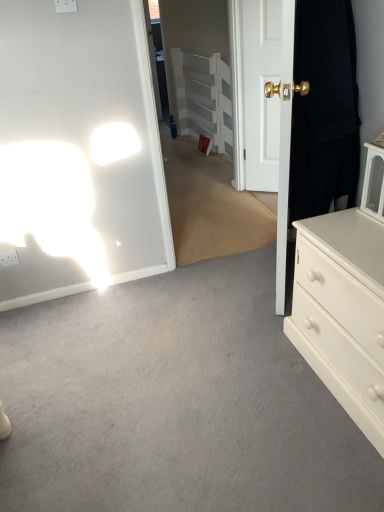
Locate an element on the screen. Image resolution: width=384 pixels, height=512 pixels. clear glass door at center is located at coordinates click(x=209, y=206).

Image resolution: width=384 pixels, height=512 pixels. Describe the element at coordinates (209, 206) in the screenshot. I see `clear glass door at center` at that location.

Image resolution: width=384 pixels, height=512 pixels. I want to click on white matte chest of drawers at right, so click(x=343, y=312).

What are the coordinates of `black fabric door at right, positioned as the 2th door in back-to-front order` in the screenshot? It's located at 323,109.

Consider the image. Which object is closer to the camera taking this photo, clear glass door at center or black fabric door at right, acting as the first door starting from the front?

black fabric door at right, acting as the first door starting from the front.

Is point (246, 230) in front of point (329, 134)?

That is False.

Is clear glass door at center to the left of black fabric door at right, positioned as the 2th door in back-to-front order, from the viewer's perspective?

Indeed, clear glass door at center is positioned on the left side of black fabric door at right, positioned as the 2th door in back-to-front order.

From a real-world perspective, between clear glass door at center and black fabric door at right, positioned as the 2th door in back-to-front order, who is vertically higher?

black fabric door at right, positioned as the 2th door in back-to-front order, is physically above.

This screenshot has height=512, width=384. Find the location of `door on the right side of white glossy door at center, arranged as the first door when viewed from the back`. door on the right side of white glossy door at center, arranged as the first door when viewed from the back is located at coordinates (323, 109).

From a real-world perspective, is white glossy door at center, arranged as the first door when viewed from the back, positioned under black fabric door at right, acting as the first door starting from the front, based on gravity?

Yes.

Is point (274, 32) less distant than point (310, 150)?

No, it is not.

Is white glossy door at center, arranged as the first door when viewed from the back, oriented away from black fabric door at right, acting as the first door starting from the front?

No, white glossy door at center, arranged as the first door when viewed from the back, is not facing the opposite direction of black fabric door at right, acting as the first door starting from the front.

What's the angular difference between white glossy door at center, arranged as the first door when viewed from the back, and clear glass door at center's facing directions?

The angular difference between white glossy door at center, arranged as the first door when viewed from the back, and clear glass door at center is 39.7 degrees.

Considering the sizes of white glossy door at center, arranged as the first door when viewed from the back, and clear glass door at center in the image, is white glossy door at center, arranged as the first door when viewed from the back, taller or shorter than clear glass door at center?

Clearly, white glossy door at center, arranged as the first door when viewed from the back, is shorter compared to clear glass door at center.

From the image's perspective, which one is positioned higher, white glossy door at center, arranged as the 2th door when viewed from the front, or clear glass door at center?

white glossy door at center, arranged as the 2th door when viewed from the front, appears higher in the image.

Which is behind, point (244, 164) or point (224, 93)?

The point (224, 93) is behind.

In the scene shown: Is white glossy door at center, arranged as the 2th door when viewed from the front, to the left or to the right of white painted wood armoire at center in the image?

From the image, it's evident that white glossy door at center, arranged as the 2th door when viewed from the front, is to the right of white painted wood armoire at center.

Can you tell me how much white glossy door at center, arranged as the first door when viewed from the back, and white painted wood armoire at center differ in facing direction?

The angular difference between white glossy door at center, arranged as the first door when viewed from the back, and white painted wood armoire at center is 45.4 degrees.

How far apart are white glossy door at center, arranged as the 2th door when viewed from the front, and white painted wood armoire at center?

white glossy door at center, arranged as the 2th door when viewed from the front, is 4.29 feet from white painted wood armoire at center.

From a real-world perspective, who is located higher, black fabric door at right, positioned as the 2th door in back-to-front order, or white glossy door at center, arranged as the 2th door when viewed from the front?

From a 3D spatial view, black fabric door at right, positioned as the 2th door in back-to-front order, is above.

Is point (331, 141) positioned after point (259, 19)?

No, (331, 141) is closer to viewer.

From the picture: Is black fabric door at right, acting as the first door starting from the front, directly adjacent to white glossy door at center, arranged as the 2th door when viewed from the front?

black fabric door at right, acting as the first door starting from the front, and white glossy door at center, arranged as the 2th door when viewed from the front, are clearly separated.

Can you confirm if black fabric door at right, positioned as the 2th door in back-to-front order, is taller than white glossy door at center, arranged as the 2th door when viewed from the front?

No, black fabric door at right, positioned as the 2th door in back-to-front order, is not taller than white glossy door at center, arranged as the 2th door when viewed from the front.

Between clear glass door at center and white glossy door at center, arranged as the 2th door when viewed from the front, which one is positioned in front?

clear glass door at center is closer to the camera.

Are clear glass door at center and white glossy door at center, arranged as the 2th door when viewed from the front, located far from each other?

No, clear glass door at center is not far away from white glossy door at center, arranged as the 2th door when viewed from the front.

Between clear glass door at center and white glossy door at center, arranged as the first door when viewed from the back, which one has smaller width?

white glossy door at center, arranged as the first door when viewed from the back, is thinner.

Considering the relative sizes of clear glass door at center and white glossy door at center, arranged as the 2th door when viewed from the front, in the image provided, is clear glass door at center bigger than white glossy door at center, arranged as the 2th door when viewed from the front,?

Correct, clear glass door at center is larger in size than white glossy door at center, arranged as the 2th door when viewed from the front.

From the image's perspective, which object appears higher, white painted wood armoire at center or white glossy door at center, arranged as the first door when viewed from the back?

From the image's view, white painted wood armoire at center is above.

Is white painted wood armoire at center looking in the opposite direction of white glossy door at center, arranged as the 2th door when viewed from the front?

white painted wood armoire at center is not turned away from white glossy door at center, arranged as the 2th door when viewed from the front.

In the scene shown: How different are the orientations of white painted wood armoire at center and white glossy door at center, arranged as the first door when viewed from the back, in degrees?

The angular difference between white painted wood armoire at center and white glossy door at center, arranged as the first door when viewed from the back, is 45.4 degrees.

Which of these two, white painted wood armoire at center or white glossy door at center, arranged as the first door when viewed from the back, is smaller?

white glossy door at center, arranged as the first door when viewed from the back, is smaller.

This screenshot has width=384, height=512. I want to click on glass door located behind the black fabric door at right, acting as the first door starting from the front, so click(x=209, y=206).

The image size is (384, 512). Identify the location of door located on the right of white glossy door at center, arranged as the 2th door when viewed from the front. (323, 109).

From the picture: When comparing their distances from white painted wood armoire at center, does white glossy door at center, arranged as the first door when viewed from the back, or black fabric door at right, positioned as the 2th door in back-to-front order, seem further?

Based on the image, black fabric door at right, positioned as the 2th door in back-to-front order, appears to be further to white painted wood armoire at center.

Which object lies further to the anchor point black fabric door at right, acting as the first door starting from the front, clear glass door at center or white glossy door at center, arranged as the first door when viewed from the back?

The object further to black fabric door at right, acting as the first door starting from the front, is clear glass door at center.

Estimate the real-world distances between objects in this image. Which object is closer to white glossy door at center, arranged as the 2th door when viewed from the front, clear glass door at center or white painted wood armoire at center?

The object closer to white glossy door at center, arranged as the 2th door when viewed from the front, is clear glass door at center.

Based on their spatial positions, is clear glass door at center or white matte chest of drawers at right further from black fabric door at right, positioned as the 2th door in back-to-front order?

Among the two, clear glass door at center is located further to black fabric door at right, positioned as the 2th door in back-to-front order.

Which object lies nearer to the anchor point black fabric door at right, positioned as the 2th door in back-to-front order, white matte chest of drawers at right or white painted wood armoire at center?

white matte chest of drawers at right.

Looking at this image, from the image, which object appears to be farther from clear glass door at center, white matte chest of drawers at right or white glossy door at center, arranged as the 2th door when viewed from the front?

white matte chest of drawers at right.

When comparing their distances from clear glass door at center, does white glossy door at center, arranged as the 2th door when viewed from the front, or white painted wood armoire at center seem closer?

The object closer to clear glass door at center is white painted wood armoire at center.

Estimate the real-world distances between objects in this image. Which object is further from white matte chest of drawers at right, white glossy door at center, arranged as the first door when viewed from the back, or black fabric door at right, acting as the first door starting from the front?

Among the two, white glossy door at center, arranged as the first door when viewed from the back, is located further to white matte chest of drawers at right.

You are a GUI agent. You are given a task and a screenshot of the screen. Output one action in this format:
    pyautogui.click(x=<x>, y=<y>)
    Task: Click on the glass door located between white matte chest of drawers at right and white glossy door at center, arranged as the first door when viewed from the back, in the depth direction
    Image resolution: width=384 pixels, height=512 pixels.
    Given the screenshot: What is the action you would take?
    pyautogui.click(x=209, y=206)

The width and height of the screenshot is (384, 512). I want to click on glass door located between white matte chest of drawers at right and white painted wood armoire at center in the depth direction, so click(209, 206).

Find the location of a particular element. glass door between black fabric door at right, positioned as the 2th door in back-to-front order, and white painted wood armoire at center from front to back is located at coordinates (209, 206).

The image size is (384, 512). Find the location of `door between clear glass door at center and white matte chest of drawers at right in the vertical direction`. door between clear glass door at center and white matte chest of drawers at right in the vertical direction is located at coordinates (323, 109).